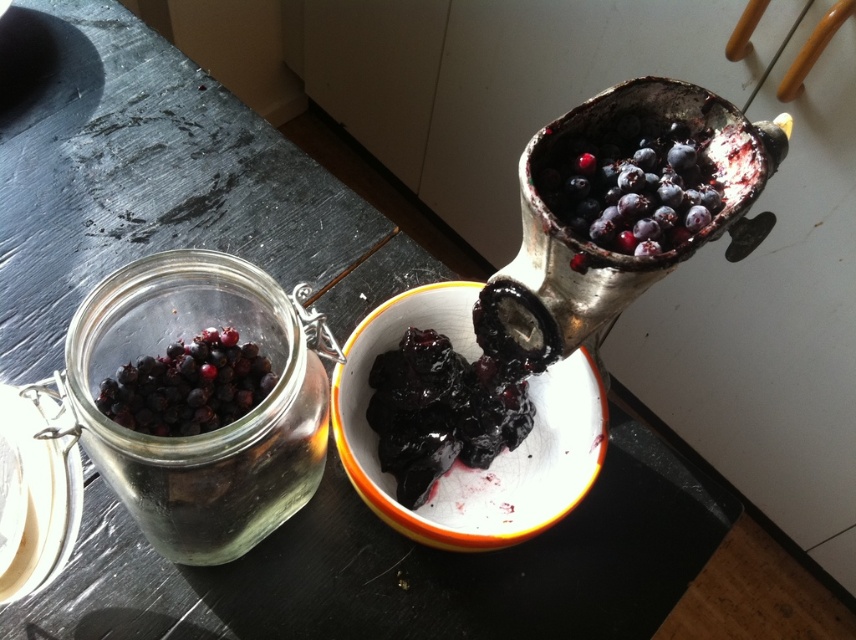
You are a chef trying to reach the point at coordinates (424,515) in the kitchen scene. The clear glass jar with metal clasp lid on the left and the white bowl with yellow orange rim in the center right are in your way. Can you estimate how far this point is from you?

The point at coordinates (424,515) is 68.15 centimeters from the viewer, so it is approximately 68.15 centimeters away from you.

Please provide the 2D coordinates of the transparent glass jar at left in the image. The coordinates should be in the format of a point with two decimal places, like this example format pointX, pointY. Please do not add any other information besides the coordinates.

The transparent glass jar at left is located at point [215,428].